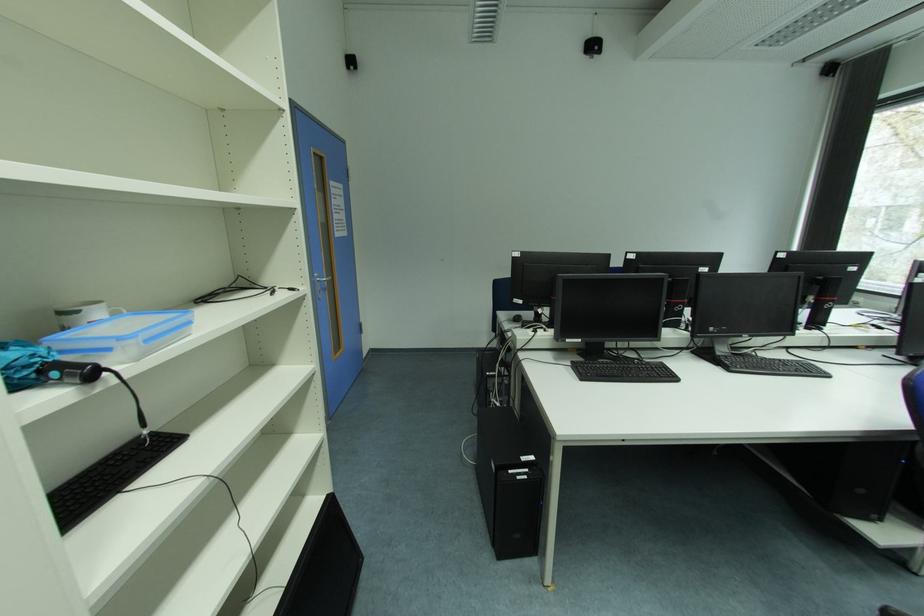
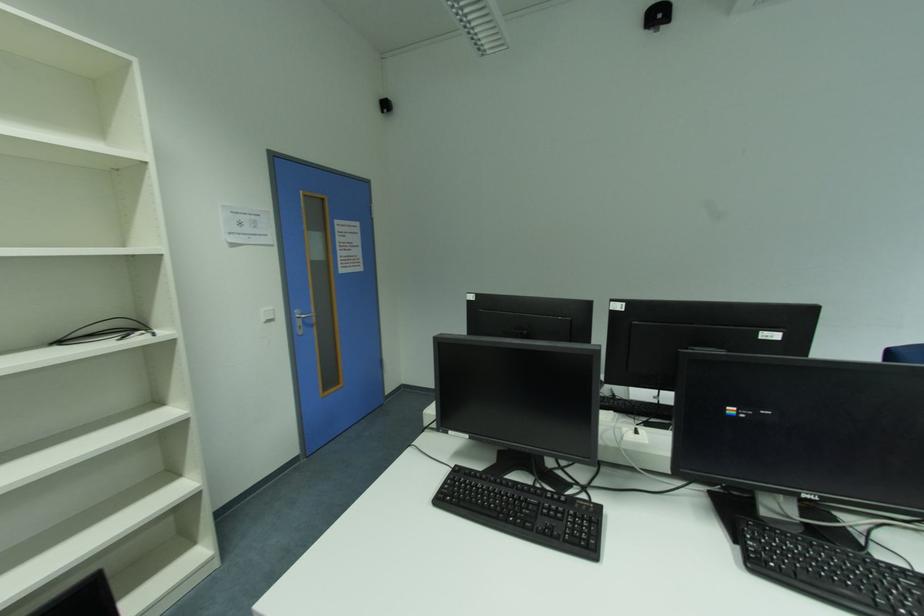
The images are taken continuously from a first-person perspective. In which direction are you moving?

The cameraman walked toward right, forward.